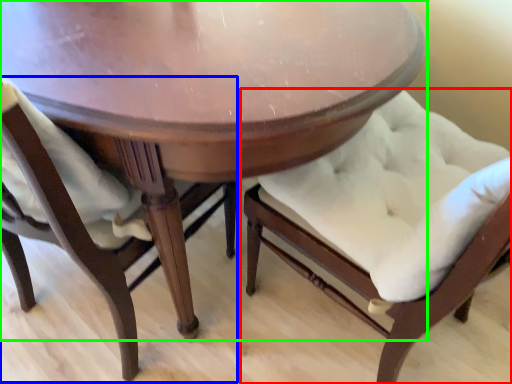
Question: Considering the real-world distances, which object is closest to chair (highlighted by a red box)? chair (highlighted by a blue box) or table (highlighted by a green box).

Choices:
 (A) chair
 (B) table

Answer: (B)